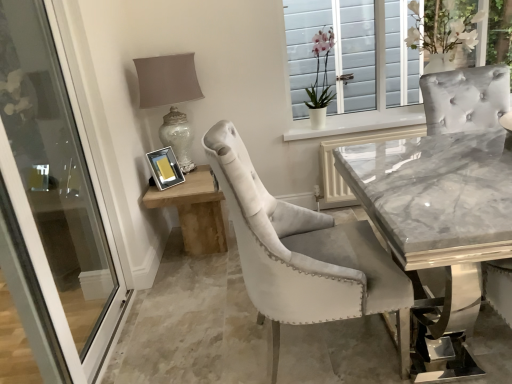
What are the coordinates of `vacant region under white glass door at left (from a real-world perspective)` in the screenshot? It's located at (110, 343).